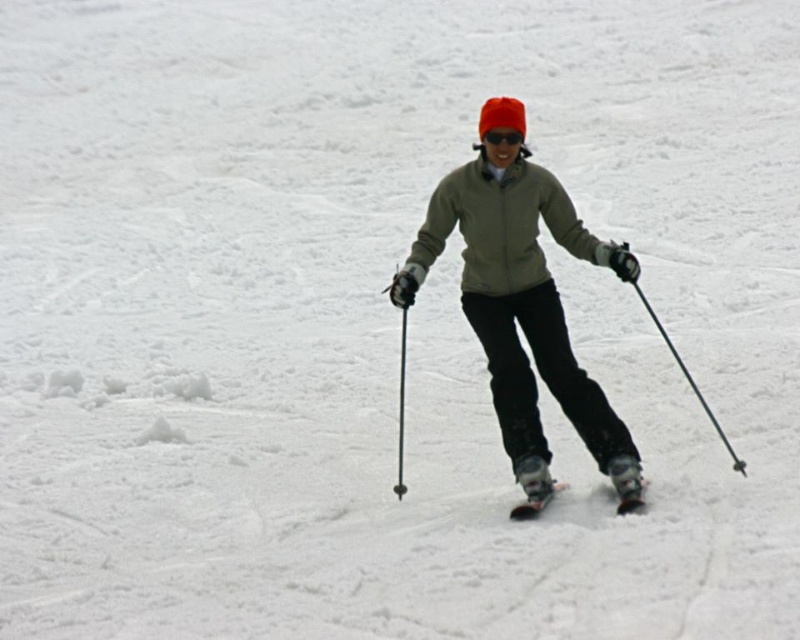
Question: Can you confirm if matte green jacket at center is positioned to the left of shiny metallic ski at center?

Choices:
 (A) no
 (B) yes

Answer: (B)

Question: Which point appears farthest from the camera in this image?

Choices:
 (A) (533, 500)
 (B) (516, 509)
 (C) (688, 381)
 (D) (554, 294)

Answer: (C)

Question: Is matte green jacket at center wider than shiny metallic skis at center?

Choices:
 (A) no
 (B) yes

Answer: (B)

Question: Is shiny metallic skis at center positioned in front of black plastic ski pole at right?

Choices:
 (A) yes
 (B) no

Answer: (B)

Question: Which of these objects is positioned farthest from the matte green jacket at center?

Choices:
 (A) shiny metallic skis at center
 (B) transparent plastic goggles at center
 (C) black plastic ski pole at right
 (D) shiny metallic ski at center

Answer: (C)

Question: Which object appears closest to the camera in this image?

Choices:
 (A) black plastic ski pole at right
 (B) shiny metallic ski at center
 (C) shiny metallic skis at center
 (D) matte green jacket at center

Answer: (A)